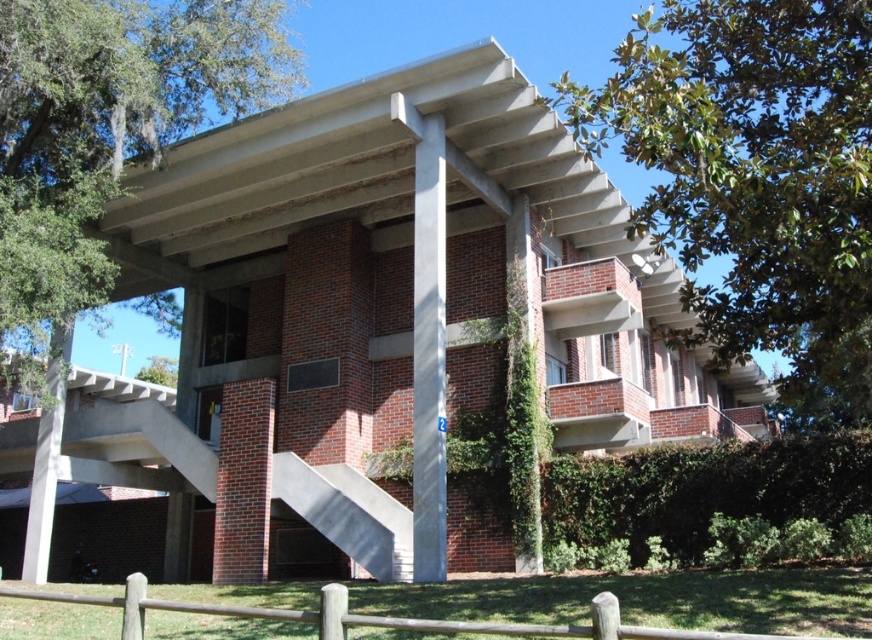
Does green leafy tree at upper left come in front of concrete/stained at lower center?

That is True.

Between green leafy tree at upper left and concrete/stained at lower center, which one is positioned higher?

Answer: green leafy tree at upper left is higher up.

Is point (249, 68) positioned after point (382, 547)?

Yes, point (249, 68) is farther from viewer.

Where is `green leafy tree at upper left`? This screenshot has width=872, height=640. green leafy tree at upper left is located at coordinates (109, 122).

Based on the photo, how much distance is there between white marble pillar at center and concrete at left?

The distance of white marble pillar at center from concrete at left is 9.45 meters.

Is white marble pillar at center behind concrete at left?

No, it is not.

Does point (419, 460) come in front of point (26, 529)?

That is True.

In order to click on white marble pillar at center in this screenshot , I will do [428, 355].

Describe the element at coordinates (428, 355) in the screenshot. I see `white marble pillar at center` at that location.

Which is behind, point (441, 506) or point (400, 506)?

The point (400, 506) is more distant.

Locate an element on the screen. white marble pillar at center is located at coordinates (428, 355).